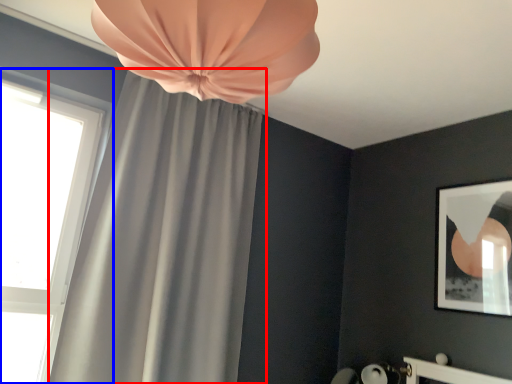
Question: Which object is further to the camera taking this photo, curtain (highlighted by a red box) or window (highlighted by a blue box)?

Choices:
 (A) curtain
 (B) window

Answer: (B)